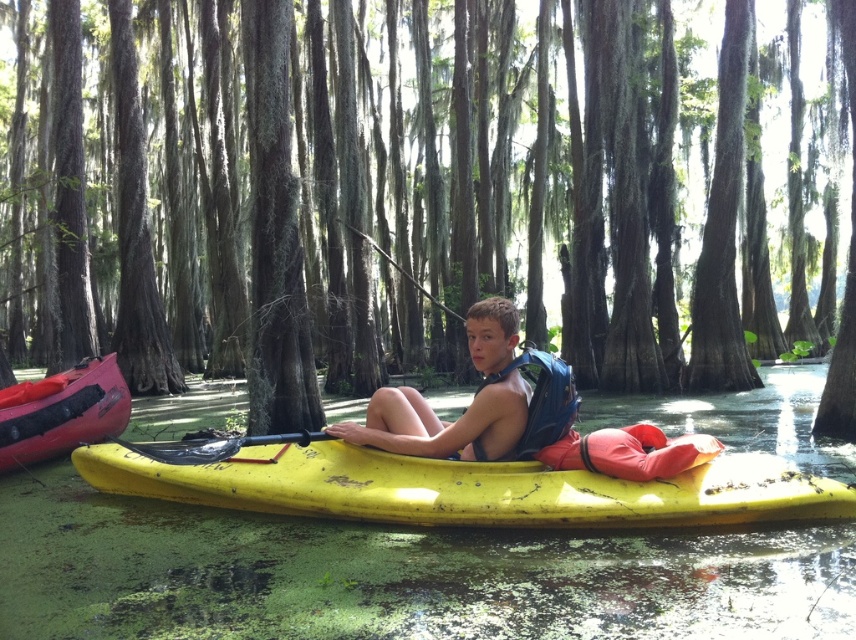
Question: Is green mossy tree at center above matte yellow kayak at center?

Choices:
 (A) yes
 (B) no

Answer: (A)

Question: Which point is farther to the camera?

Choices:
 (A) (411, 64)
 (B) (346, 486)
 (C) (51, 422)
 (D) (816, 445)

Answer: (A)

Question: Which point is closer to the camera taking this photo?

Choices:
 (A) (51, 381)
 (B) (76, 449)
 (C) (68, 61)

Answer: (B)

Question: Is rubberized red canoe at left wider than black rubber paddle at center?

Choices:
 (A) yes
 (B) no

Answer: (B)

Question: Is green algae water at center below matte yellow kayak at center?

Choices:
 (A) no
 (B) yes

Answer: (B)

Question: Which point is farther from the camera taking this photo?

Choices:
 (A) (498, 432)
 (B) (33, 444)
 (C) (272, 458)

Answer: (B)